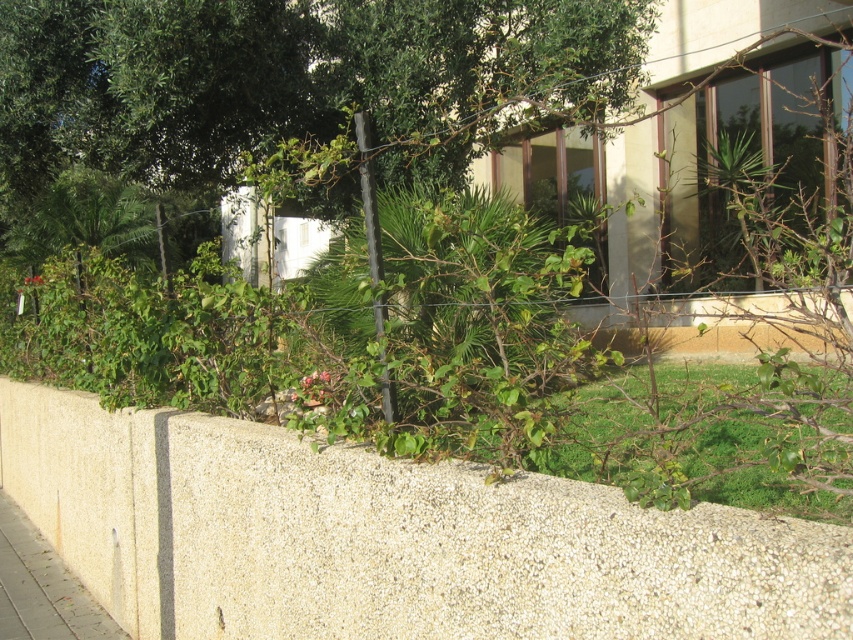
Question: Considering the relative positions of beige concrete wall at lower left and gray concrete pavement at lower left in the image provided, where is beige concrete wall at lower left located with respect to gray concrete pavement at lower left?

Choices:
 (A) above
 (B) below

Answer: (A)

Question: Can you confirm if beige concrete wall at lower left is bigger than gray concrete pavement at lower left?

Choices:
 (A) yes
 (B) no

Answer: (B)

Question: Which object appears closest to the camera in this image?

Choices:
 (A) gray concrete pavement at lower left
 (B) beige concrete wall at lower left

Answer: (B)

Question: Does beige concrete wall at lower left appear on the right side of gray concrete pavement at lower left?

Choices:
 (A) no
 (B) yes

Answer: (B)